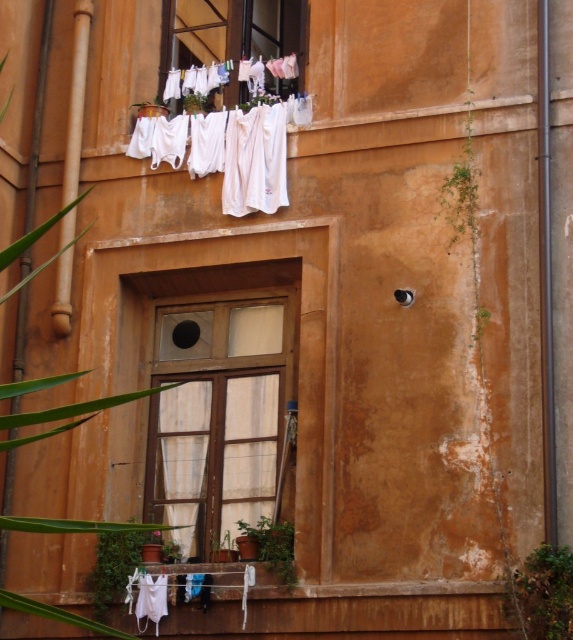
Between white fabric at upper center and white sheer curtain at center, which one is positioned lower?

Positioned lower is white sheer curtain at center.

At what (x,y) coordinates should I click in order to perform the action: click on white fabric at upper center. Please return your answer as a coordinate pair (x, y). The width and height of the screenshot is (573, 640). Looking at the image, I should click on (234, 35).

Does point (190, 44) come closer to viewer compared to point (194, 410)?

No.

At what (x,y) coordinates should I click in order to perform the action: click on white fabric at upper center. Please return your answer as a coordinate pair (x, y). The height and width of the screenshot is (640, 573). Looking at the image, I should click on [234, 35].

Does point (189, 493) come farther from viewer compared to point (179, 467)?

No, (189, 493) is closer to viewer.

Image resolution: width=573 pixels, height=640 pixels. Identify the location of wooden frame at center. (217, 419).

Identify the location of wooden frame at center. 217,419.

Is point (213, 346) positioned before point (238, 35)?

Yes, it is in front of point (238, 35).

Image resolution: width=573 pixels, height=640 pixels. In order to click on wooden frame at center in this screenshot , I will do `click(217, 419)`.